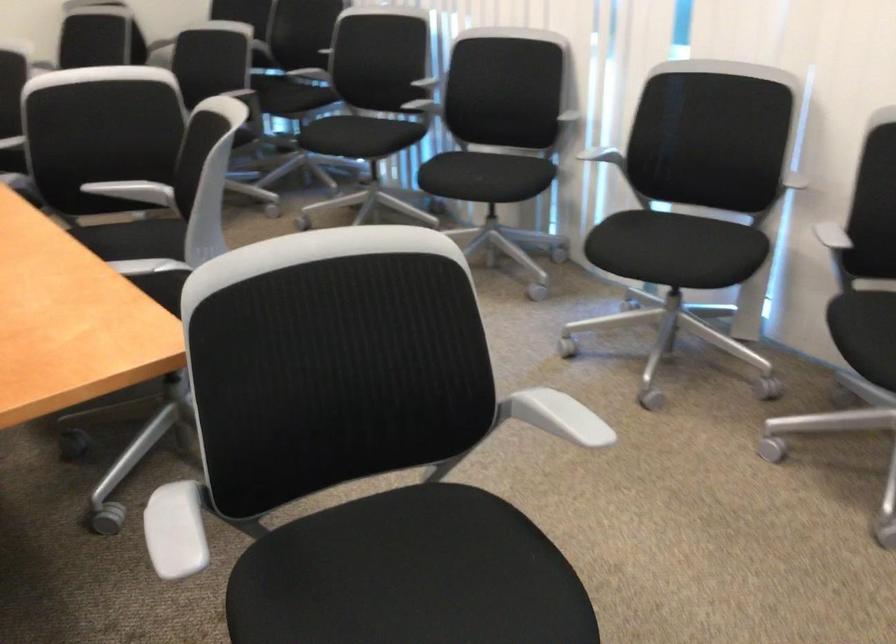
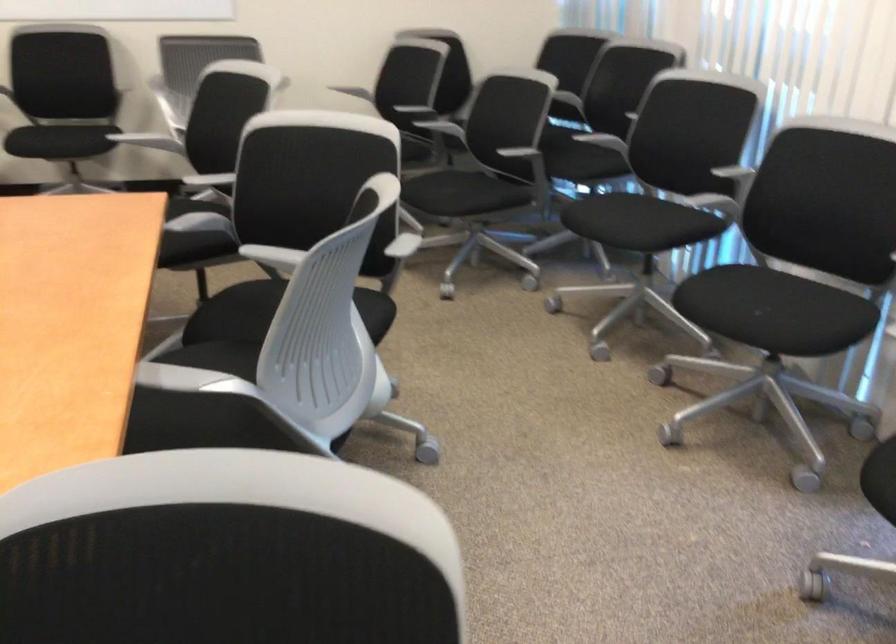
Where in the second image is the point corresponding to pixel 583 310 from the first image?

(858, 527)